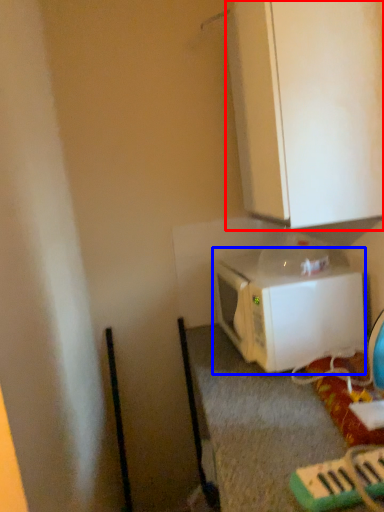
Question: Which of the following is the farthest to the observer, cabinetry (highlighted by a red box) or microwave oven (highlighted by a blue box)?

Choices:
 (A) cabinetry
 (B) microwave oven

Answer: (B)